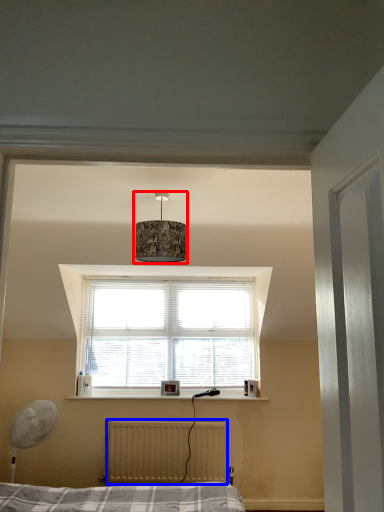
Question: Which point is closer to the camera, lamp (highlighted by a red box) or radiator (highlighted by a blue box)?

Choices:
 (A) lamp
 (B) radiator

Answer: (A)